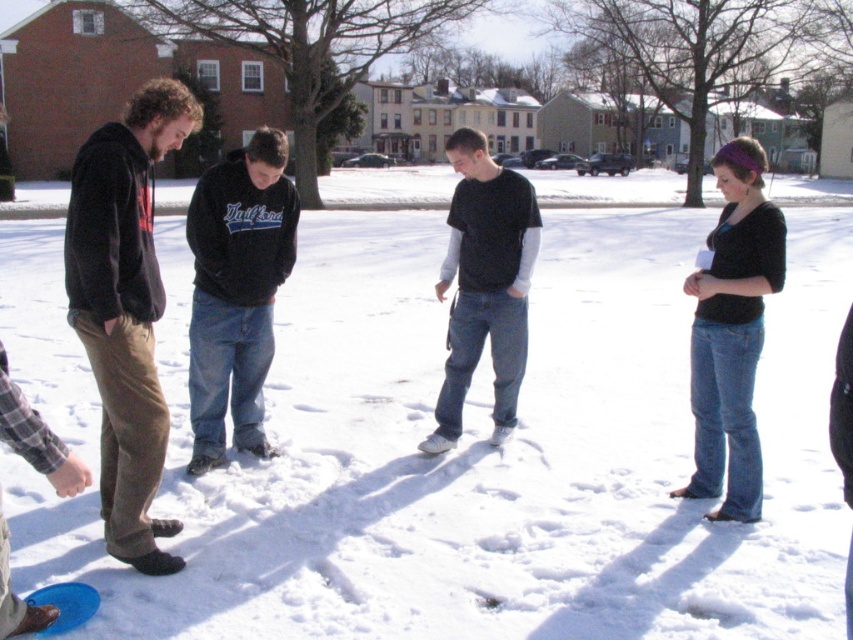
You are a photographer trying to capture a group photo of the black cotton hoodie at center and the black cotton shirt at center. Since both are at the center, which one should you focus on first to ensure they are both in focus?

The black cotton hoodie at center is positioned on the left side of the black cotton shirt at center, so focusing on the black cotton hoodie at center first would ensure both are in focus as they are closely positioned.

You are standing in the snowy scene and want to hand a gift to the person wearing the black cotton shirt at center. Which direction should you walk to approach them from the dark brown corduroy pants at left?

You should walk to the right from the dark brown corduroy pants at left to reach the black cotton shirt at center since the dark brown corduroy pants at left is positioned to the left of the black cotton shirt at center.